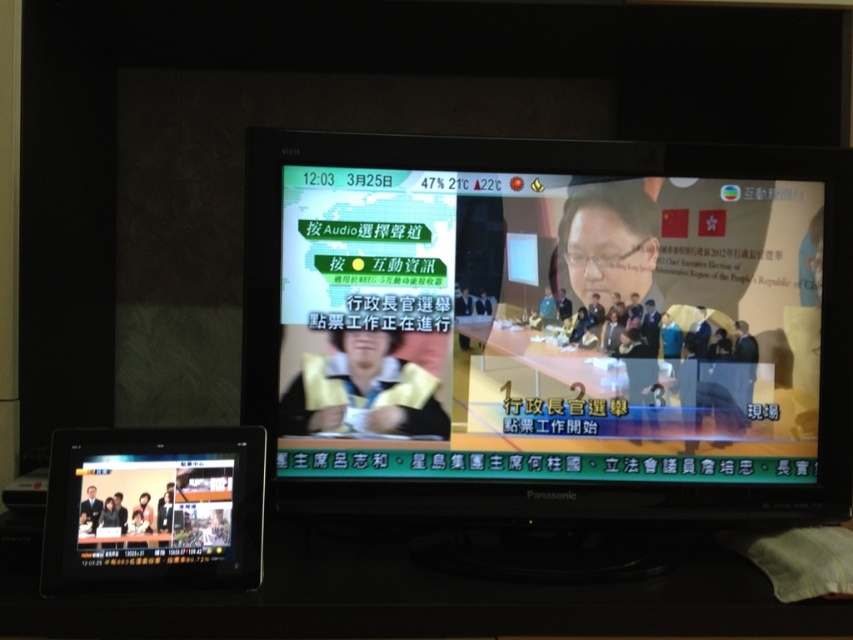
Question: Does matte black monitor at center have a larger size compared to black glossy tablet at lower left?

Choices:
 (A) yes
 (B) no

Answer: (A)

Question: Which of the following is the closest to the observer?

Choices:
 (A) (276, 454)
 (B) (108, 522)

Answer: (B)

Question: Is matte black monitor at center to the right of black glossy tablet at lower left from the viewer's perspective?

Choices:
 (A) no
 (B) yes

Answer: (B)

Question: Which point is farther from the camera taking this photo?

Choices:
 (A) (102, 509)
 (B) (335, 394)

Answer: (B)

Question: Is matte black monitor at center above black glossy tablet at lower left?

Choices:
 (A) yes
 (B) no

Answer: (A)